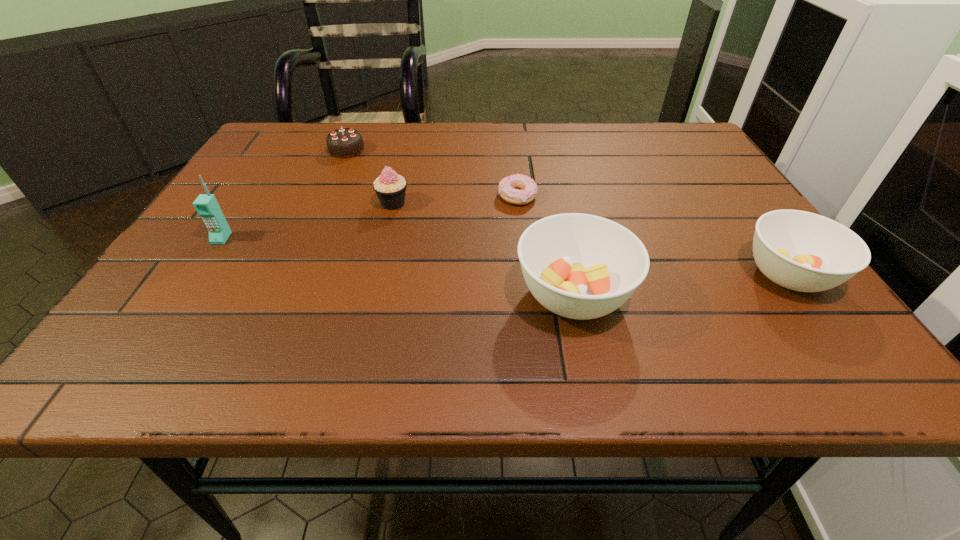
The width and height of the screenshot is (960, 540). Identify the location of vacant space at the near edge of the desktop. (458, 303).

Image resolution: width=960 pixels, height=540 pixels. I want to click on blank space at the left edge of the desktop, so click(253, 200).

This screenshot has width=960, height=540. Identify the location of vacant space at the right edge of the desktop. (742, 287).

At what (x,y) coordinates should I click in order to perform the action: click on vacant area at the far right corner. Please return your answer as a coordinate pair (x, y). Image resolution: width=960 pixels, height=540 pixels. Looking at the image, I should click on (643, 128).

Locate an element on the screen. free point between the cellular telephone and the right soup bowl is located at coordinates (505, 256).

Identify the location of free space that is in between the farthest object and the cupcake. This screenshot has width=960, height=540. (370, 177).

Identify the location of free spot between the tallest object and the shortest object. The width and height of the screenshot is (960, 540). (370, 218).

The width and height of the screenshot is (960, 540). I want to click on free space between the farthest object and the third object from left to right, so click(370, 177).

At what (x,y) coordinates should I click in order to perform the action: click on free area in between the shortest object and the fourth object from right to left. Please return your answer as a coordinate pair (x, y). Looking at the image, I should click on (455, 200).

The image size is (960, 540). I want to click on vacant space in between the cellular telephone and the doughnut, so coord(370,218).